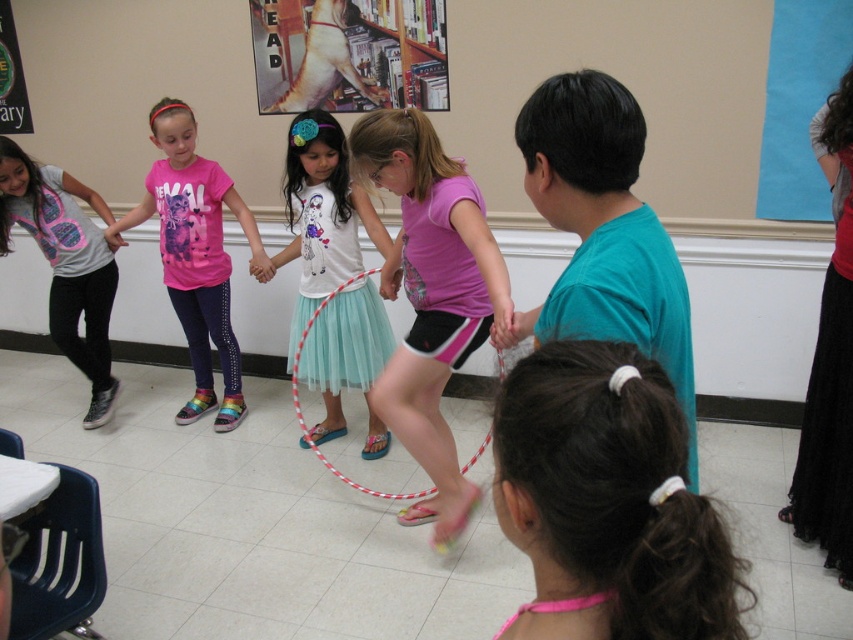
Question: Is dark brown hair at lower center below pink matte shorts at center?

Choices:
 (A) yes
 (B) no

Answer: (A)

Question: Among these objects, which one is nearest to the camera?

Choices:
 (A) teal smooth shirt at upper right
 (B) dark brown hair at lower center

Answer: (B)

Question: Which object is the closest to the teal smooth shirt at upper right?

Choices:
 (A) teal tulle skirt at center
 (B) matte pink t-shirt at center

Answer: (A)

Question: Does matte pink t-shirt at center appear on the left side of red and white striped jump rope at center?

Choices:
 (A) no
 (B) yes

Answer: (B)

Question: Observing the image, what is the correct spatial positioning of pink matte shorts at center in reference to matte pink hula hoop at center?

Choices:
 (A) left
 (B) right

Answer: (A)

Question: Which of the following is the farthest from the observer?

Choices:
 (A) red and white striped jump rope at center
 (B) pink matte shorts at center
 (C) matte pink hula hoop at center
 (D) dark brown hair at lower center

Answer: (A)